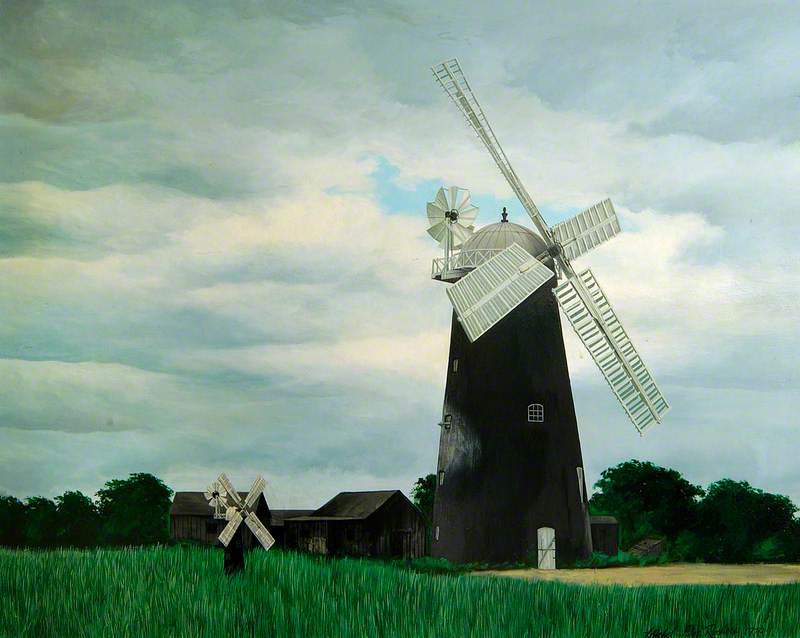
What are the coordinates of `windows` in the screenshot? It's located at (534, 411), (350, 530), (306, 531), (212, 527).